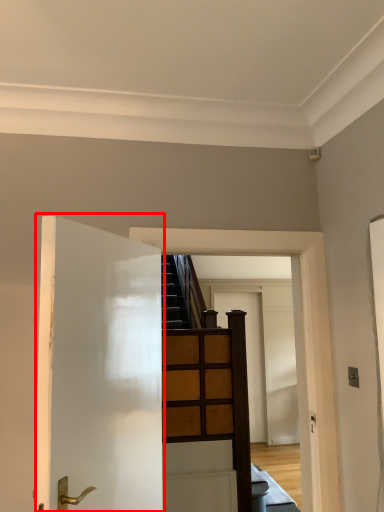
Question: From the image's perspective, where is door (annotated by the red box) located relative to door?

Choices:
 (A) above
 (B) below

Answer: (A)